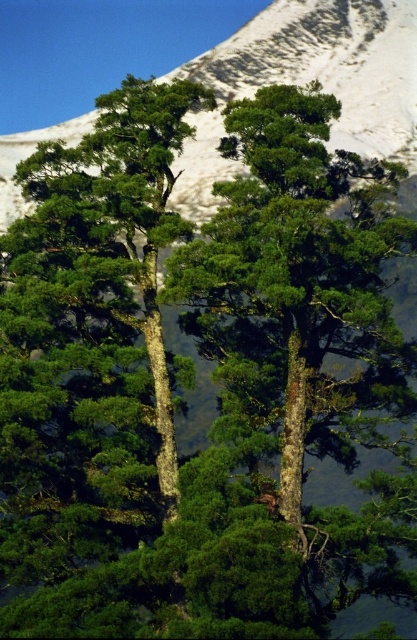
Question: Can you confirm if green rough bark tree at center is smaller than snowy white mountain at upper center?

Choices:
 (A) no
 (B) yes

Answer: (B)

Question: Among these objects, which one is nearest to the camera?

Choices:
 (A) green rough bark tree at center
 (B) snowy white mountain at upper center

Answer: (A)

Question: Is green rough bark tree at center wider than snowy white mountain at upper center?

Choices:
 (A) no
 (B) yes

Answer: (A)

Question: Which point is farther to the camera?

Choices:
 (A) green rough bark tree at center
 (B) snowy white mountain at upper center

Answer: (B)

Question: Is green rough bark tree at center bigger than snowy white mountain at upper center?

Choices:
 (A) yes
 (B) no

Answer: (B)